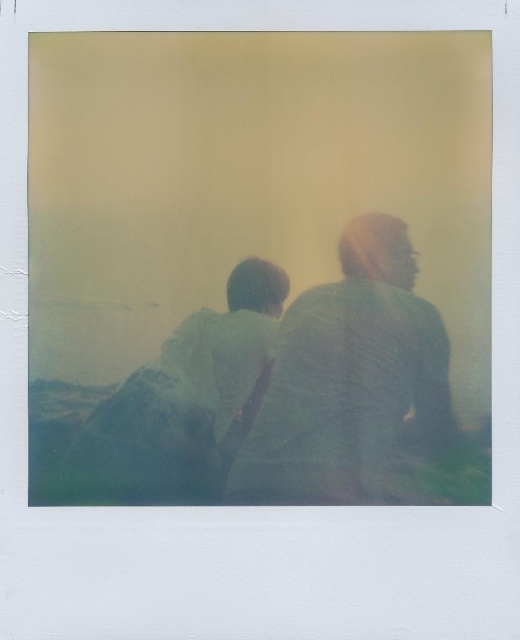
Between textured gray shirt at center and green fabric shirt at left, which one appears on the left side from the viewer's perspective?

Positioned to the left is green fabric shirt at left.

Does textured gray shirt at center have a greater height compared to green fabric shirt at left?

Yes, textured gray shirt at center is taller than green fabric shirt at left.

Identify the location of textured gray shirt at center. This screenshot has height=640, width=520. (347, 380).

Where is `textured gray shirt at center`? textured gray shirt at center is located at coordinates (347, 380).